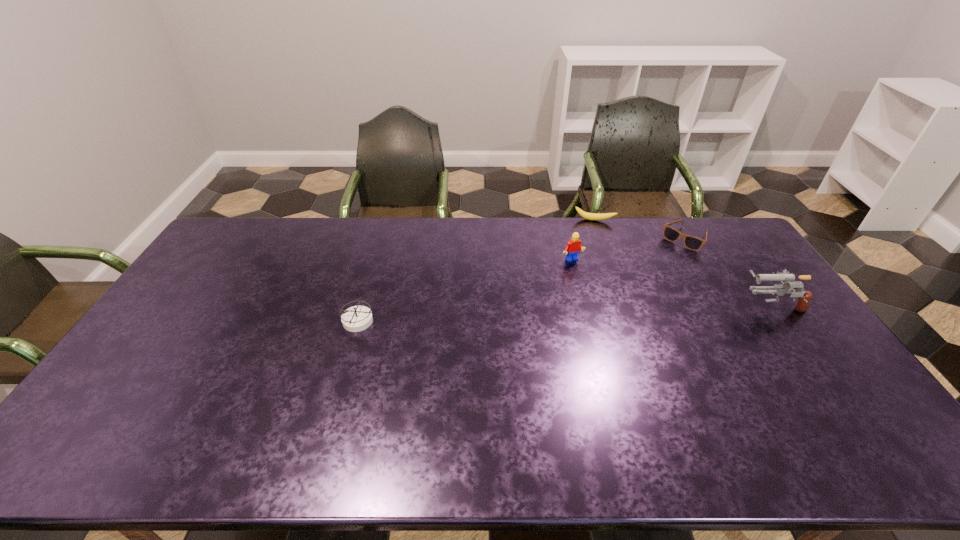
Image resolution: width=960 pixels, height=540 pixels. What are the coordinates of `the leftmost object` in the screenshot? It's located at (357, 318).

The height and width of the screenshot is (540, 960). In order to click on the tallest object in this screenshot , I will do `click(804, 297)`.

You are a GUI agent. You are given a task and a screenshot of the screen. Output one action in this format:
    pyautogui.click(x=<x>, y=<y>)
    Task: Click on the third nearest object
    This screenshot has width=960, height=540.
    Given the screenshot: What is the action you would take?
    pyautogui.click(x=573, y=247)

Where is `the fourth shortest object`? The width and height of the screenshot is (960, 540). the fourth shortest object is located at coordinates (573, 247).

The height and width of the screenshot is (540, 960). Find the location of `the third object from right to left`. the third object from right to left is located at coordinates (589, 216).

Where is `the farthest object`? The image size is (960, 540). the farthest object is located at coordinates (589, 216).

Where is `the fourth nearest object`? the fourth nearest object is located at coordinates (693, 243).

At what (x,y) coordinates should I click in order to perform the action: click on blank area located 0.140m on the right of the compass. Please return your answer as a coordinate pair (x, y). Looking at the image, I should click on (421, 320).

At what (x,y) coordinates should I click in order to perform the action: click on vacant space located at the barrel end of the gun. Please return your answer as a coordinate pair (x, y). Image resolution: width=960 pixels, height=540 pixels. Looking at the image, I should click on (708, 306).

Image resolution: width=960 pixels, height=540 pixels. I want to click on free space located 0.050m at the barrel end of the gun, so click(723, 306).